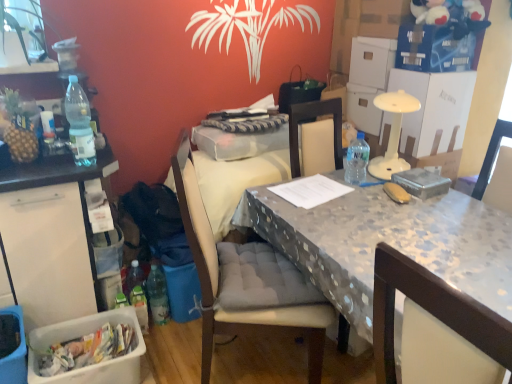
Question: Can you confirm if white plastic bin at left is smaller than fabric cushioned chair at center?

Choices:
 (A) yes
 (B) no

Answer: (A)

Question: Is white plastic bin at left positioned beyond the bounds of fabric cushioned chair at center?

Choices:
 (A) yes
 (B) no

Answer: (A)

Question: Is white plastic bin at left taller than fabric cushioned chair at center?

Choices:
 (A) no
 (B) yes

Answer: (A)

Question: Is fabric cushioned chair at center located within white plastic bin at left?

Choices:
 (A) no
 (B) yes

Answer: (A)

Question: From the image's perspective, is white plastic bin at left located above fabric cushioned chair at center?

Choices:
 (A) yes
 (B) no

Answer: (A)

Question: Is white plastic bin at left behind fabric cushioned chair at center?

Choices:
 (A) no
 (B) yes

Answer: (B)

Question: Is fabric cushioned chair at center positioned beyond the bounds of transparent plastic bottle at table right, positioned as the 3th bottle in left-to-right order?

Choices:
 (A) no
 (B) yes

Answer: (B)

Question: From a real-world perspective, is fabric cushioned chair at center physically below transparent plastic bottle at table right, the 2th bottle positioned from the front?

Choices:
 (A) yes
 (B) no

Answer: (A)

Question: Is fabric cushioned chair at center further to the viewer compared to transparent plastic bottle at table right, arranged as the second bottle when ordered from the bottom?

Choices:
 (A) no
 (B) yes

Answer: (A)

Question: Can you confirm if fabric cushioned chair at center is taller than transparent plastic bottle at table right, which is the second bottle from top to bottom?

Choices:
 (A) yes
 (B) no

Answer: (A)

Question: Is the surface of fabric cushioned chair at center in direct contact with transparent plastic bottle at table right, which is the second bottle from top to bottom?

Choices:
 (A) no
 (B) yes

Answer: (A)

Question: Can you confirm if fabric cushioned chair at center is smaller than transparent plastic bottle at table right, which is the second bottle from top to bottom?

Choices:
 (A) yes
 (B) no

Answer: (B)

Question: Is plastic picnic basket at lower left wider than fabric cushioned chair at center?

Choices:
 (A) no
 (B) yes

Answer: (A)